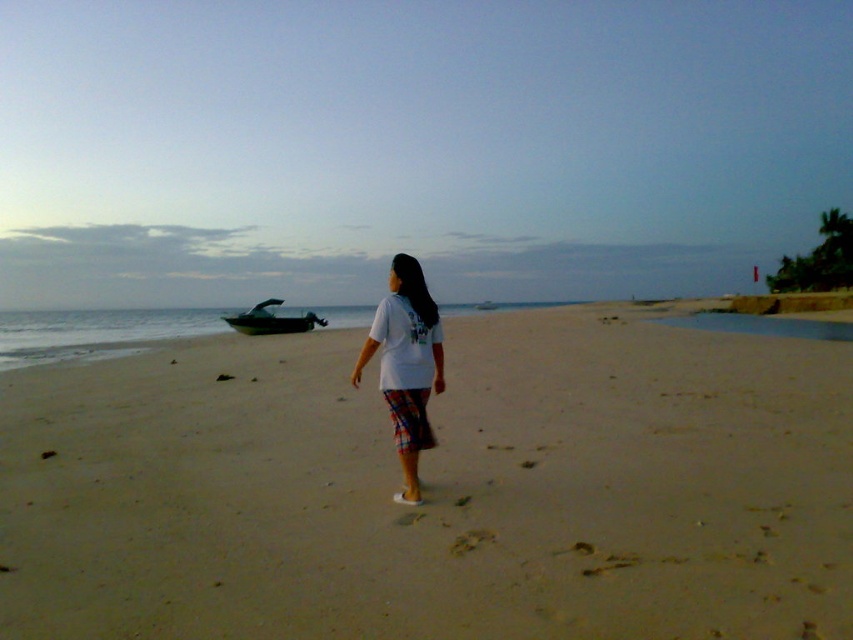
You are standing on the beach and see the light brown sand at center and the metallic silver boat at left. Which object is closer to the water?

The light brown sand at center is closer to the water because it is positioned below the metallic silver boat at left.

You are standing at the beach and see two points marked on the sand. The first point is at coordinates point (645, 541) and the second is at point (434, 339). Which point is closer to you?

Point (645, 541) is closer to the camera than point (434, 339).